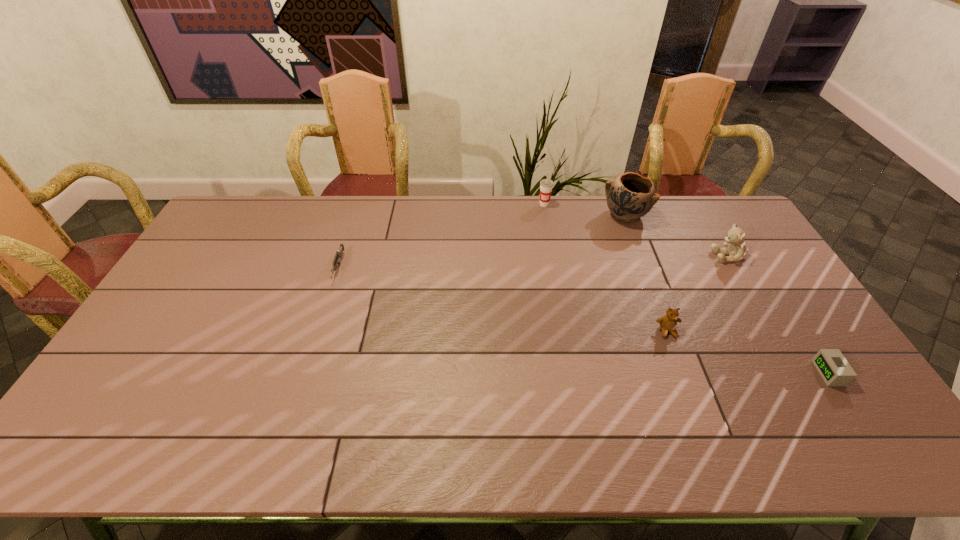
Image resolution: width=960 pixels, height=540 pixels. Find the location of `teddy bear that is at the right edge`. teddy bear that is at the right edge is located at coordinates (736, 250).

Identify the location of alarm clock located in the right edge section of the desktop. The width and height of the screenshot is (960, 540). (835, 370).

Locate an element on the screen. free space at the far edge of the desktop is located at coordinates (377, 202).

Locate an element on the screen. free space at the near edge of the desktop is located at coordinates (740, 438).

At what (x,y) coordinates should I click in order to perform the action: click on vacant space at the right edge. Please return your answer as a coordinate pair (x, y). This screenshot has height=540, width=960. Looking at the image, I should click on (747, 265).

This screenshot has height=540, width=960. I want to click on vacant space at the near right corner of the desktop, so click(x=859, y=426).

I want to click on free space between the pottery and the alarm clock, so click(727, 294).

In order to click on free space between the fourth tallest object and the leftmost object in this screenshot , I will do `click(503, 300)`.

Locate an element on the screen. empty location between the fifth object from right to left and the third shortest object is located at coordinates (606, 268).

Find the location of a particular element. vacant area that lies between the nearest object and the pottery is located at coordinates (727, 294).